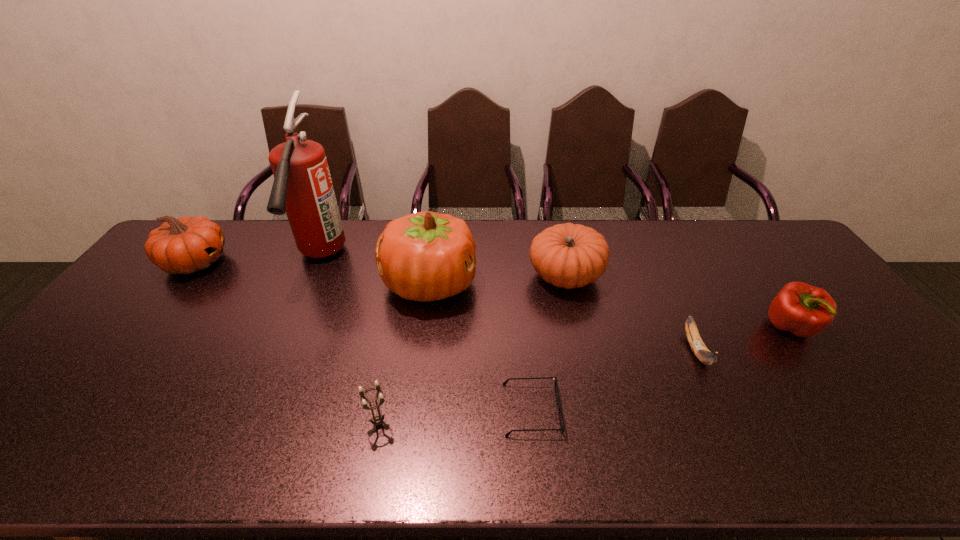
You are a GUI agent. You are given a task and a screenshot of the screen. Output one action in this format:
    pyautogui.click(x=<x>, y=<y>)
    Task: Click on the spectacles
    The height and width of the screenshot is (540, 960).
    Given the screenshot: What is the action you would take?
    pyautogui.click(x=562, y=427)

Where is `free space located at the nozzle of the tallest object`? Image resolution: width=960 pixels, height=540 pixels. free space located at the nozzle of the tallest object is located at coordinates (262, 389).

The image size is (960, 540). Identify the location of blank space located 0.390m on the side of the tallest pumpkin with the cute face. (601, 284).

Locate an element on the screen. This screenshot has width=960, height=540. vacant space situated 0.180m on the face of the leftmost pumpkin is located at coordinates (283, 262).

Find the location of a particular element. The width and height of the screenshot is (960, 540). blank space located 0.130m on the back of the rightmost pumpkin is located at coordinates (556, 230).

At what (x,y) coordinates should I click in order to perform the action: click on free point located on the left of the rightmost object. Please return your answer as a coordinate pair (x, y). Looking at the image, I should click on (650, 328).

Image resolution: width=960 pixels, height=540 pixels. What are the coordinates of `vacant space located on the left of the candle holder` in the screenshot? It's located at (340, 423).

The height and width of the screenshot is (540, 960). I want to click on free space located at the stem of the banana, so click(x=737, y=439).

Identify the location of blank space located 0.270m on the front-facing side of the shortest object. (674, 409).

Locate an element on the screen. This screenshot has width=960, height=540. fire extinguisher positioned at the far edge is located at coordinates (302, 188).